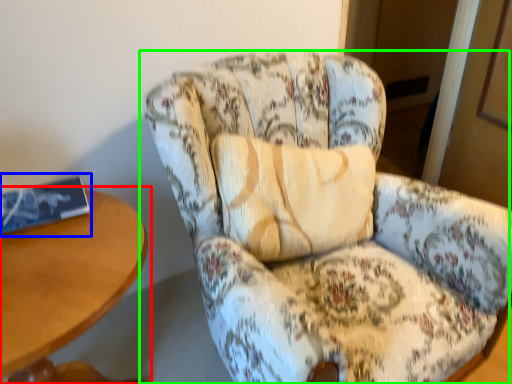
Question: Which object is the farthest from table (highlighted by a red box)? Choose among these: book (highlighted by a blue box) or chair (highlighted by a green box).

Choices:
 (A) book
 (B) chair

Answer: (B)